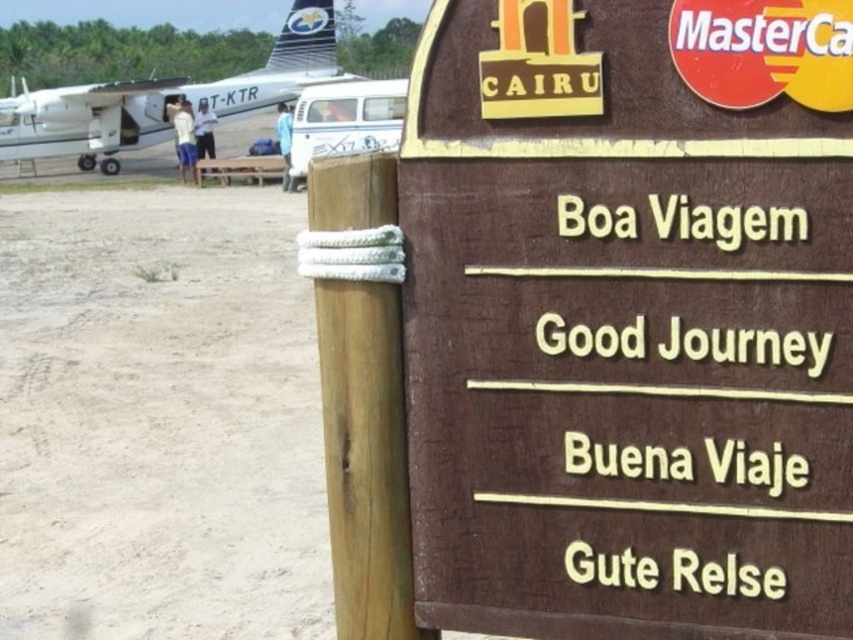
You are at an airport and see the brown wooden sign at center and the white glossy airplane at upper left. Which object is smaller in size?

The brown wooden sign at center is smaller than the white glossy airplane at upper left.

You are standing on the light brown sand at lower left and want to reach the brown wooden sign at center. Which direction should you move to get there?

The brown wooden sign at center is to the right of light brown sand at lower left, so you should move to the right to reach it.

Based on the photo, you are standing in front of a signboard and looking at the brown wooden sign at center and the light brown sand at lower left. Which object takes up more space in the image?

The light brown sand at lower left takes up more space in the image than the brown wooden sign at center because the brown wooden sign at center occupies less space than light brown sand at lower left.